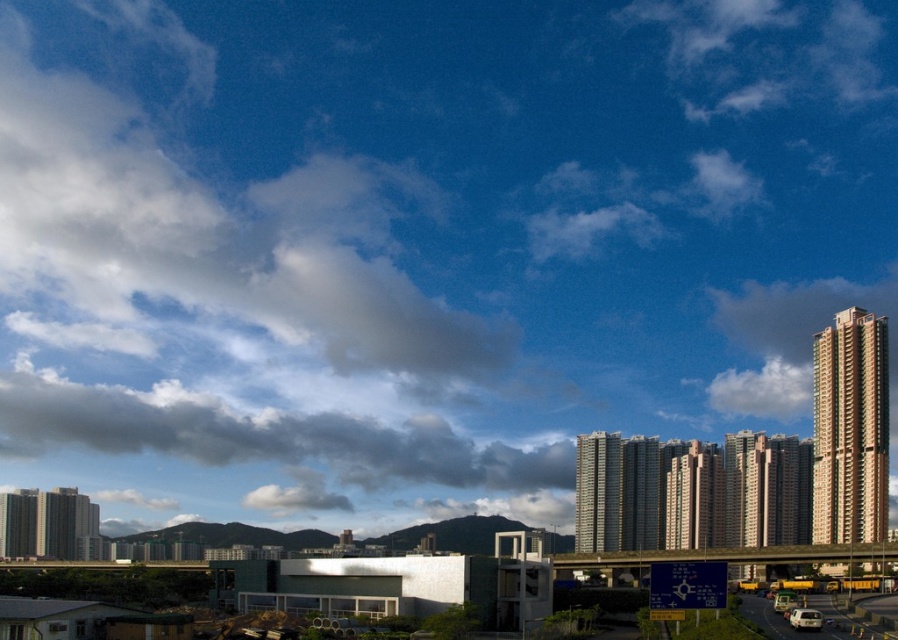
You are a weather observer looking at the sky in this urban scene. You notice the dark gray cloud at upper left and the white fluffy cloud at upper right. Which cloud covers a larger area in the sky?

The dark gray cloud at upper left covers a larger area in the sky than the white fluffy cloud at upper right because it is bigger.

You are a drone operator flying a drone over the urban landscape described. Your drone is currently above the dark gray cloud at upper left and needs to navigate to the yellow metallic highway at lower right. Based on the scene, will the drone have a clear path to the highway without any obstructions?

The yellow metallic highway at lower right is behind the dark gray cloud at upper left, so the drone will not encounter any obstructions between them as the highway is positioned further away from the cloud in the scene.

You are a delivery driver navigating through the city. You need to reach a destination located near the metallic gray overpass at center. Based on the image, can you determine if the point marked by coordinates point (731, 556) is directly above the road with vehicles moving along it?

Yes, the point marked by coordinates point (731, 556) is directly above the road with vehicles moving along it because the metallic gray overpass at center is positioned over the road.